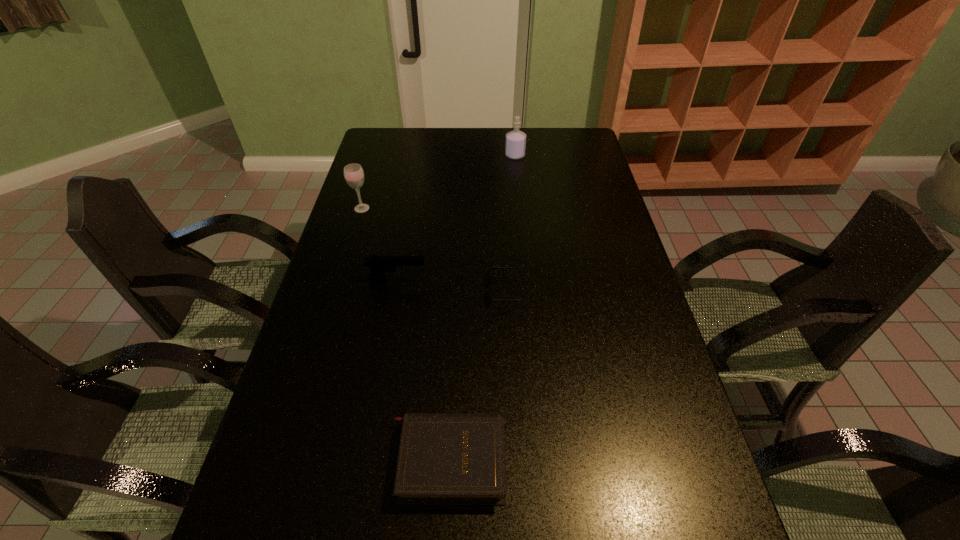
Locate which object ranks third in proximity to the fourth nearest object. Please provide its 2D coordinates. Your answer should be formatted as a tuple, i.e. [(x, y)], where the tuple contains the x and y coordinates of a point satisfying the conditions above.

[(515, 145)]

Identify the location of vacant area that satisfies the following two spatial constraints: 1. on the front-facing side of the Bible; 2. on the right side of the pistol. This screenshot has width=960, height=540. (364, 460).